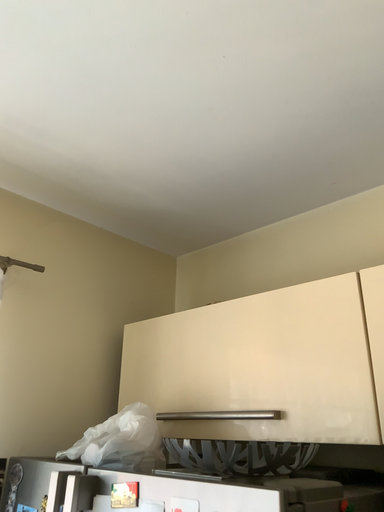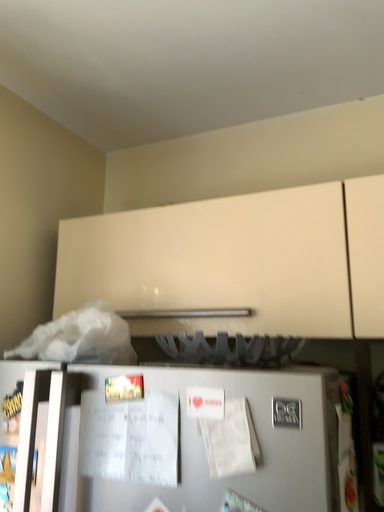
Question: Which way did the camera rotate in the video?

Choices:
 (A) rotated downward
 (B) rotated upward

Answer: (A)